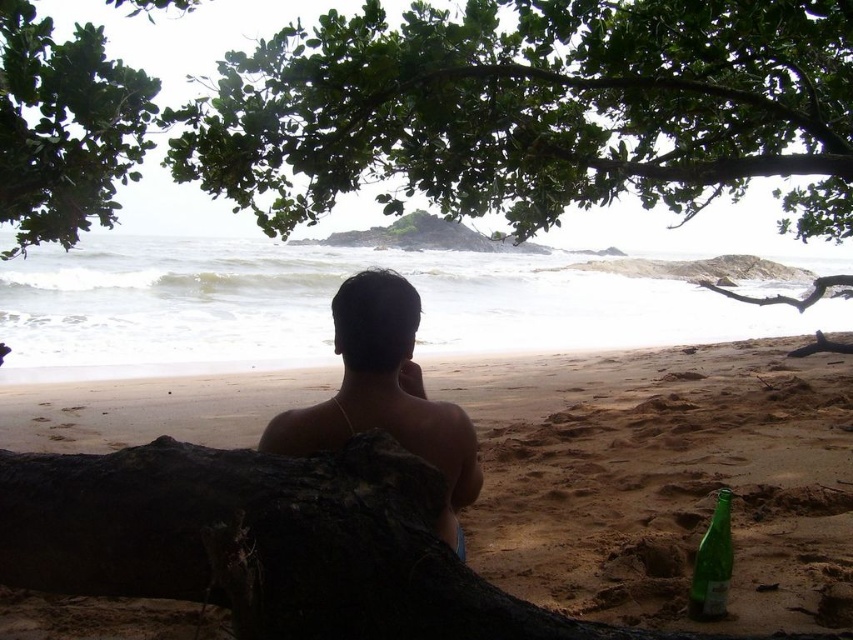
Locate an element on the screen. green leafy tree at upper center is located at coordinates (535, 109).

Find the location of a particular element. green leafy tree at upper center is located at coordinates (535, 109).

Is green leafy tree at upper left shorter than green glass bottle at lower right?

Incorrect, green leafy tree at upper left's height does not fall short of green glass bottle at lower right's.

Identify the location of green leafy tree at upper left. (64, 128).

Which is more to the right, sandy yellow at lower center or green glass bottle at lower right?

green glass bottle at lower right is more to the right.

Can you confirm if sandy yellow at lower center is bigger than green glass bottle at lower right?

Correct, sandy yellow at lower center is larger in size than green glass bottle at lower right.

I want to click on sandy yellow at lower center, so click(x=663, y=480).